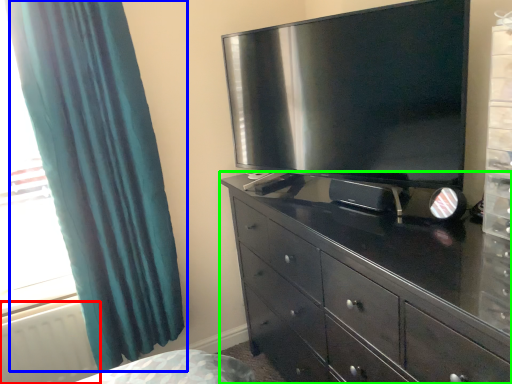
Question: Which object is positioned closest to radiator (highlighted by a red box)? Select from curtain (highlighted by a blue box) and chest of drawers (highlighted by a green box).

Choices:
 (A) curtain
 (B) chest of drawers

Answer: (A)